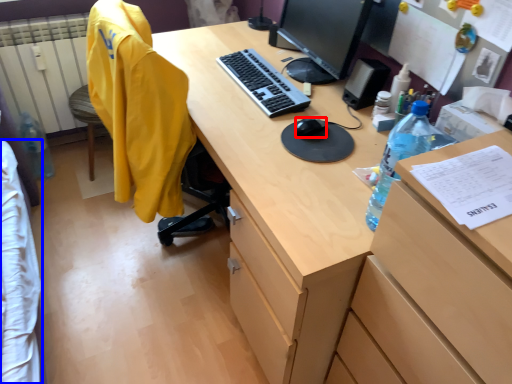
Question: Which of the following is the closest to the observer, mouse (highlighted by a red box) or clothing (highlighted by a blue box)?

Choices:
 (A) mouse
 (B) clothing

Answer: (B)